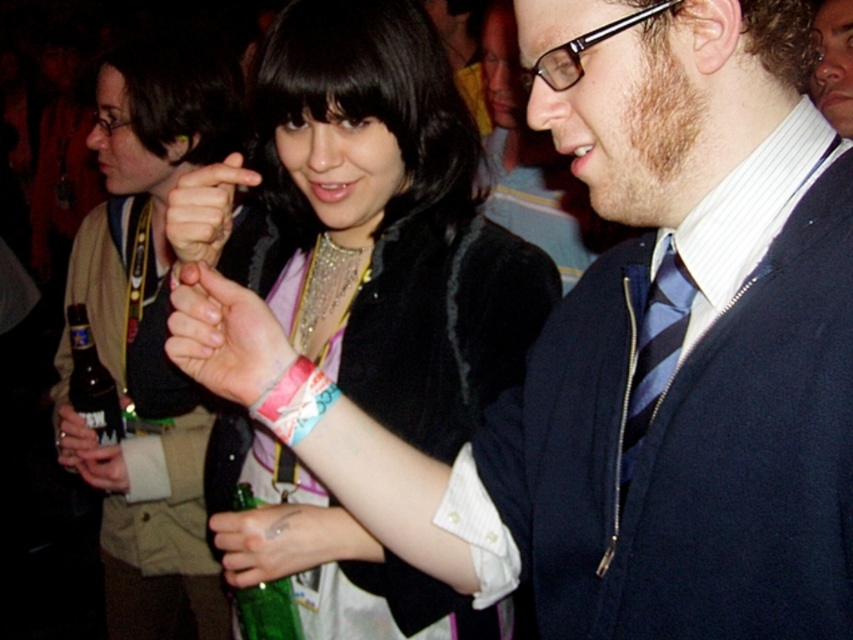
You are at a party and want to check if your wristband is visible from the entrance. The entrance is at the bottom of the image. Which object is higher up, the matte black wristband at center or the green glass bottle at lower left?

The matte black wristband at center is above the green glass bottle at lower left, so the wristband is higher up and would be visible from the entrance.

You are at a party and want to hand a note to the person wearing the blue striped tie at center without being noticed. The green glass bottle at lower left is blocking your path. Can you walk around the bottle to reach the tie?

The blue striped tie at center is in front of the green glass bottle at lower left, so the bottle is behind the tie. To reach the tie, you can approach directly without needing to go around the bottle since the bottle is not blocking the path.